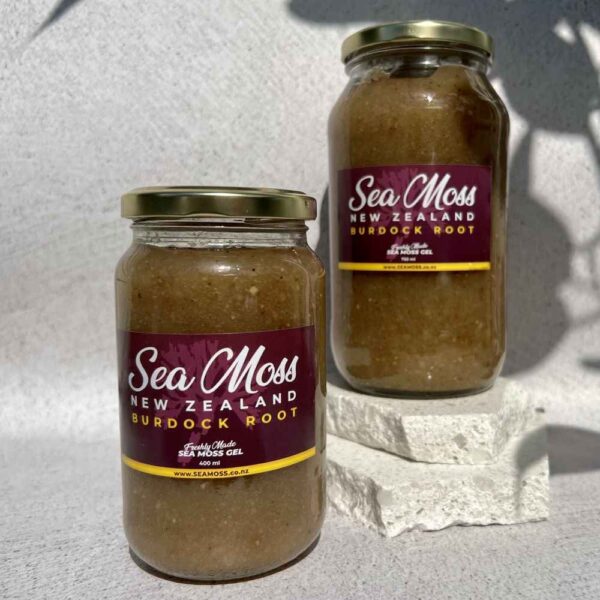
Find the location of a particular element. The width and height of the screenshot is (600, 600). empty space on wall above sauce is located at coordinates (105, 96).